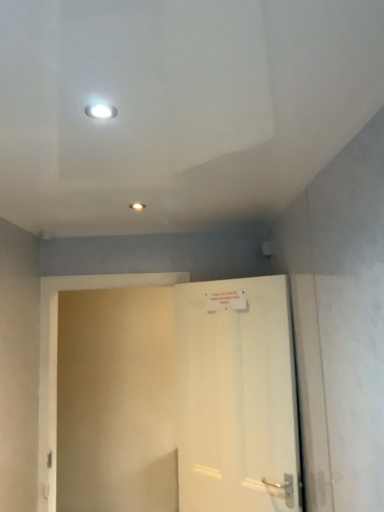
Question: In the image, is white matte door at center positioned in front of or behind white glossy light fixture at upper center?

Choices:
 (A) behind
 (B) front

Answer: (A)

Question: From a real-world perspective, is white matte door at center physically located above or below white glossy light fixture at upper center?

Choices:
 (A) below
 (B) above

Answer: (A)

Question: In terms of size, does white matte door at center appear bigger or smaller than white glossy light fixture at upper center?

Choices:
 (A) big
 (B) small

Answer: (A)

Question: Considering their positions, is white glossy light fixture at upper center located in front of or behind white matte door at center?

Choices:
 (A) front
 (B) behind

Answer: (A)

Question: From a real-world perspective, relative to white matte door at center, is white glossy light fixture at upper center vertically above or below?

Choices:
 (A) above
 (B) below

Answer: (A)

Question: Is point (99, 104) positioned closer to the camera than point (243, 397)?

Choices:
 (A) farther
 (B) closer

Answer: (B)

Question: Is white glossy light fixture at upper center taller or shorter than white matte door at center?

Choices:
 (A) tall
 (B) short

Answer: (B)